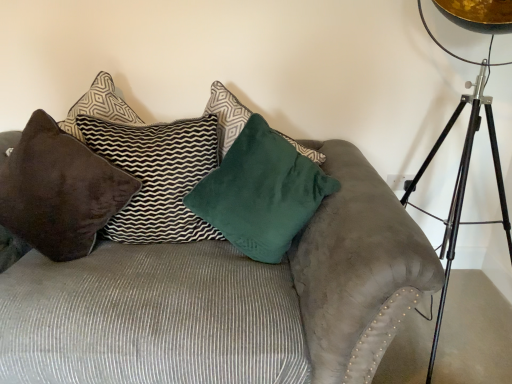
Question: Based on their sizes in the image, would you say velvet green pillow at center, the 3th pillow positioned from the left, is bigger or smaller than velvet brown pillow at upper left, which ranks as the 2th pillow in left-to-right order?

Choices:
 (A) small
 (B) big

Answer: (B)

Question: From the image's perspective, is velvet green pillow at center, the 3th pillow positioned from the left, above or below velvet brown pillow at upper left, which ranks as the 2th pillow in left-to-right order?

Choices:
 (A) above
 (B) below

Answer: (B)

Question: Which object is the closest to the velvet brown pillow at left, the first pillow viewed from the left?

Choices:
 (A) suede couch at center
 (B) velvet brown pillow at upper left, the second pillow when ordered from right to left
 (C) velvet green pillow at center, the 3th pillow positioned from the left

Answer: (B)

Question: Based on their relative distances, which object is farther from the suede couch at center?

Choices:
 (A) velvet green pillow at center, the 3th pillow positioned from the left
 (B) velvet brown pillow at upper left, which ranks as the 2th pillow in left-to-right order
 (C) velvet brown pillow at left, the first pillow viewed from the left

Answer: (B)